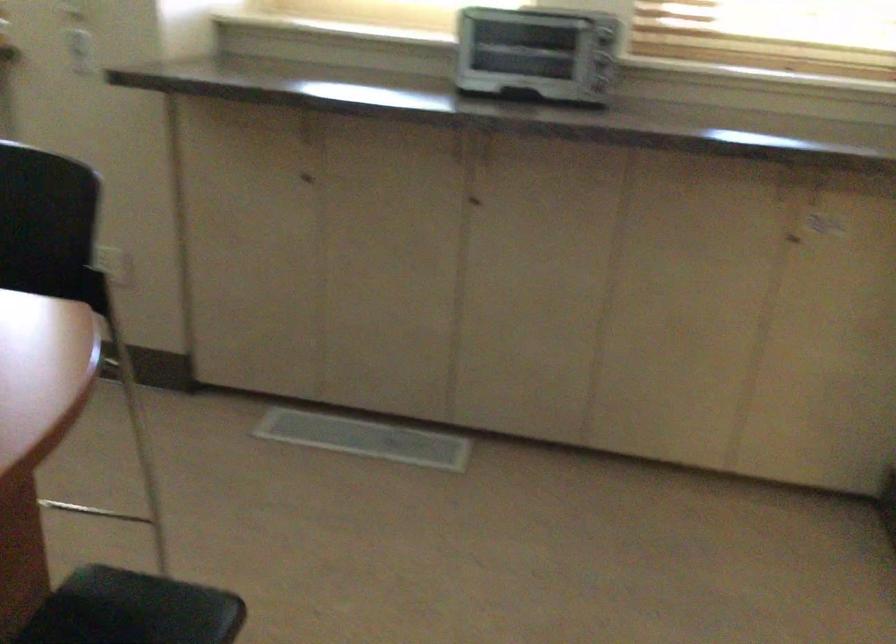
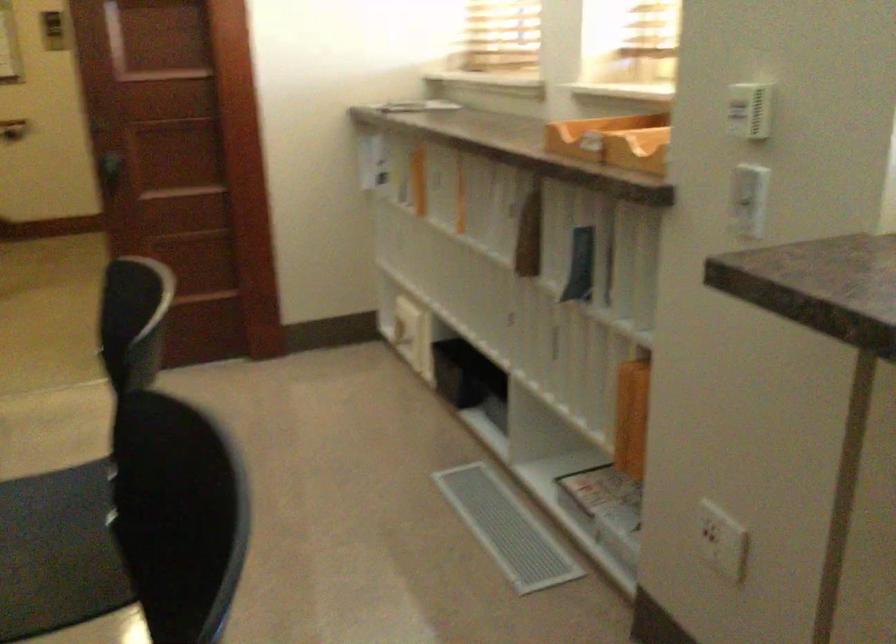
In the second image, find the point that corresponds to pixel 108 258 in the first image.

(721, 541)